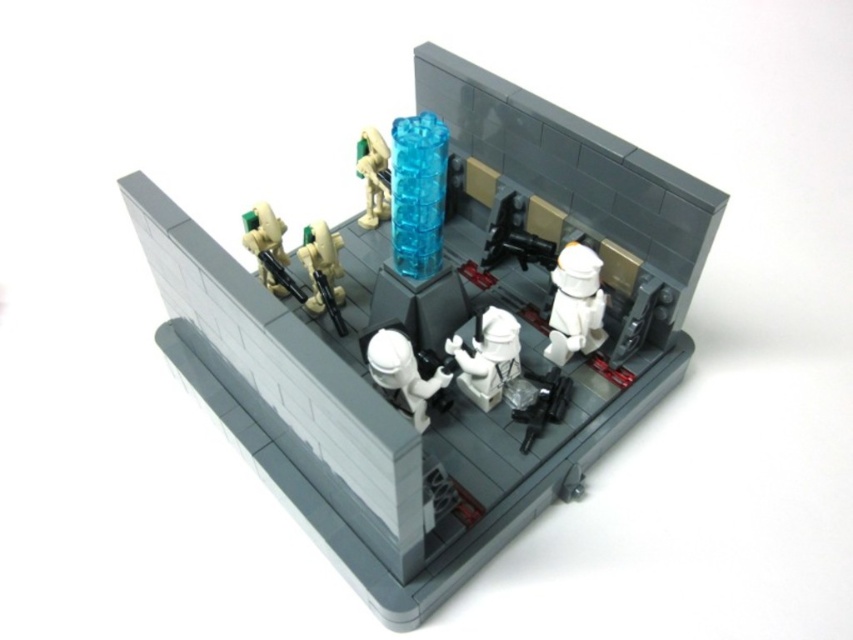
You are a LEGO builder trying to place a new small accessory on the LEGO diorama. The accessory is designed to fit on figures that are at least 3 inches tall. Based on the scene, can you determine if the white matte stormtrooper at center or the white matte figure at center can accommodate the accessory?

The white matte stormtrooper at center is much taller than the white matte figure at center. Since the accessory requires at least 3 inches, the stormtrooper is likely tall enough, but the figure might be too short. Check their exact heights to confirm.

You are a LEGO figure standing at the point labeled point [582,324]. You want to move to the point labeled point [451,372]. Can you move forward directly towards your destination without needing to turn?

Point [582,324] is behind point [451,372], so you can move forward directly towards your destination without needing to turn.